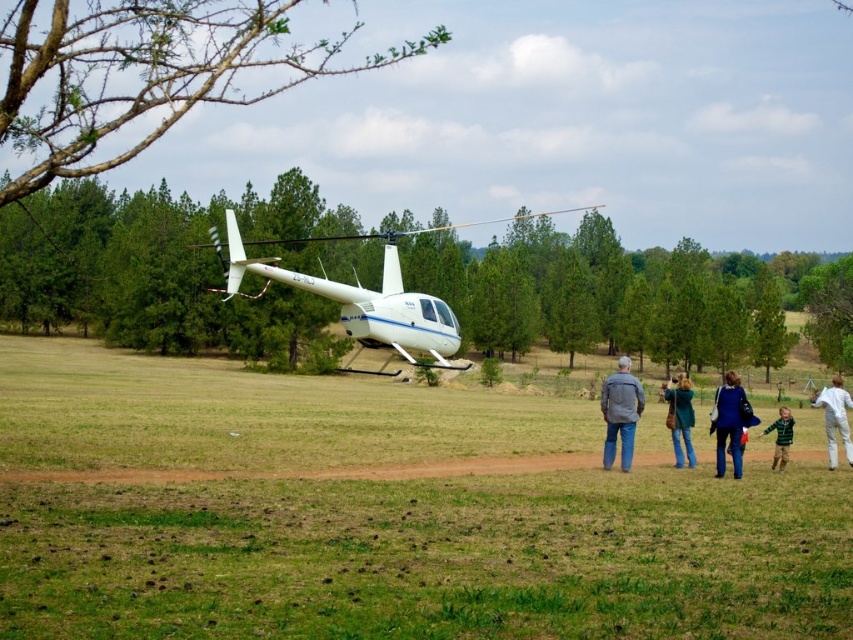
Question: Among these objects, which one is nearest to the camera?

Choices:
 (A) green wool sweater at lower right
 (B) white cotton pants at lower right

Answer: (A)

Question: Is white cotton pants at lower right positioned at the back of green wool sweater at lower right?

Choices:
 (A) yes
 (B) no

Answer: (A)

Question: Is green grass at center below white glossy helicopter at center?

Choices:
 (A) yes
 (B) no

Answer: (A)

Question: Which of the following is the farthest from the observer?

Choices:
 (A) (735, 429)
 (B) (270, 484)
 (C) (846, 422)

Answer: (C)

Question: Does gray fabric jacket at center have a smaller size compared to blue denim jeans at center?

Choices:
 (A) no
 (B) yes

Answer: (B)

Question: Which point is closer to the camera?

Choices:
 (A) (387, 264)
 (B) (102, 436)
 (C) (780, 417)

Answer: (C)